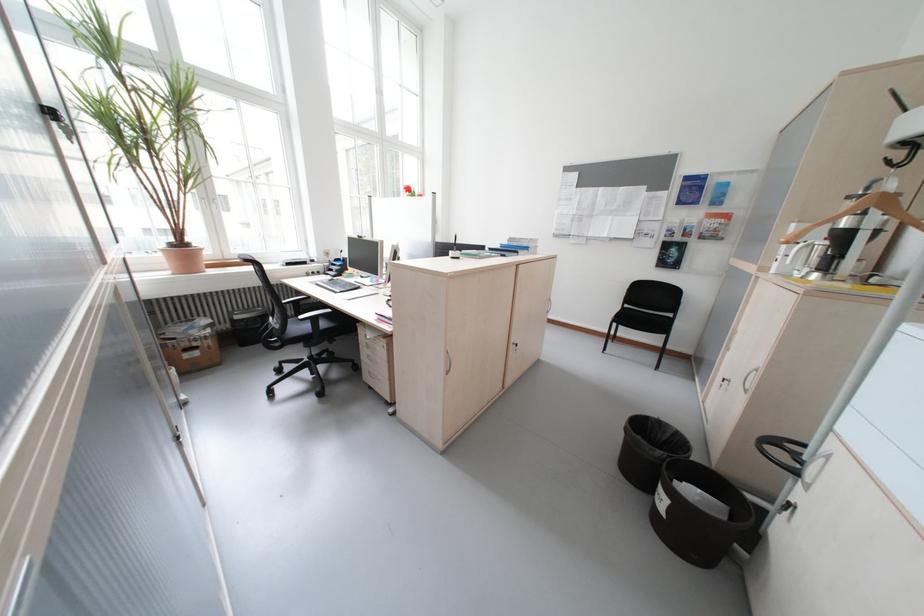
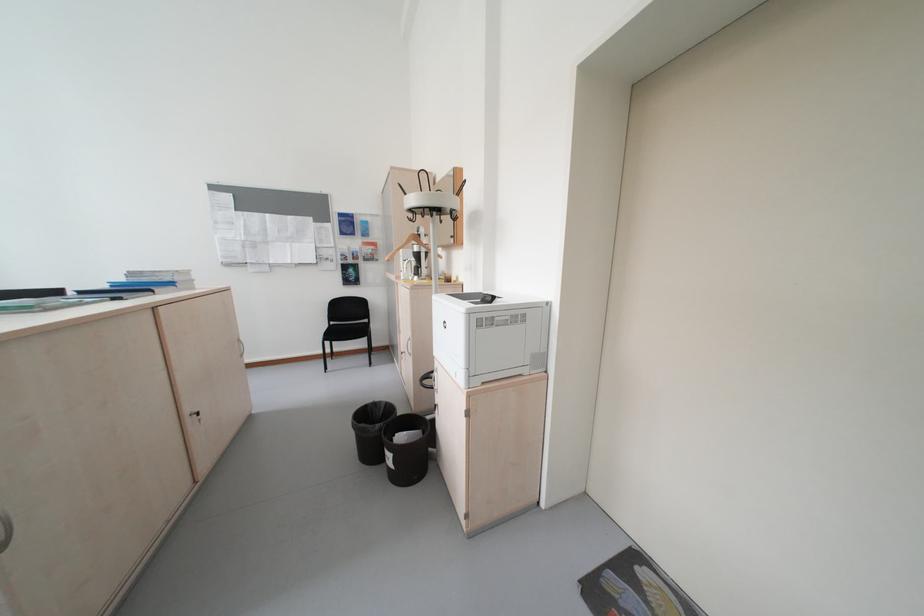
Find the pixel in the second image that matches the point at 746,235 in the first image.

(393, 257)